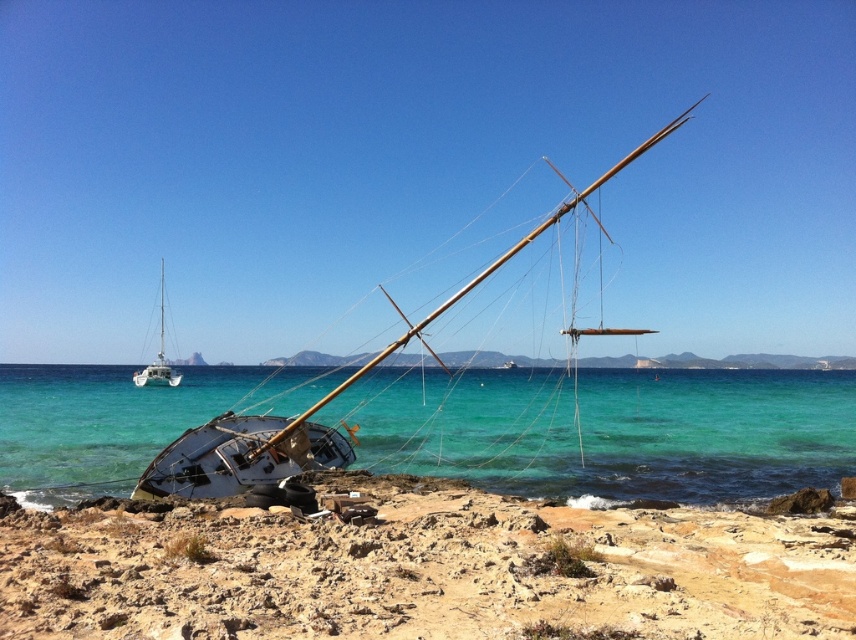
Question: Which object is positioned farthest from the white matte sailboat at left?

Choices:
 (A) rusty metal boat at lower left
 (B) clear turquoise water at lower center

Answer: (A)

Question: Does rusty metal boat at lower left have a larger size compared to white matte sailboat at left?

Choices:
 (A) no
 (B) yes

Answer: (A)

Question: Which of the following is the closest to the observer?

Choices:
 (A) (242, 474)
 (B) (34, 404)
 (C) (736, 636)
 (D) (177, 374)

Answer: (C)

Question: Does clear turquoise water at lower center have a larger size compared to white matte sailboat at left?

Choices:
 (A) yes
 (B) no

Answer: (A)

Question: Does clear turquoise water at lower center have a lesser width compared to white matte sailboat at left?

Choices:
 (A) no
 (B) yes

Answer: (A)

Question: Which is farther from the white matte sailboat at left?

Choices:
 (A) clear turquoise water at lower center
 (B) rusty metal boat at lower left
 (C) white wooden sailboat at center

Answer: (C)